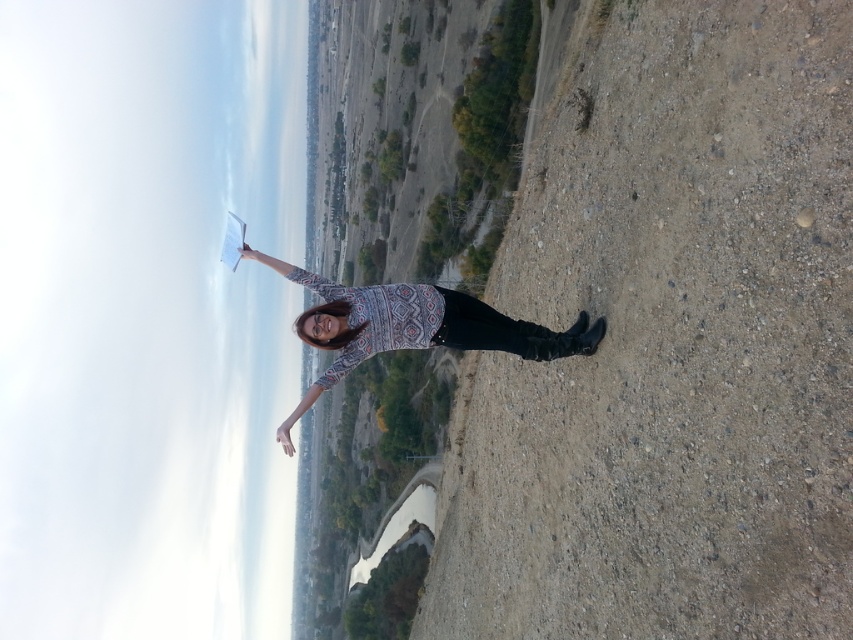
Question: Among these objects, which one is nearest to the camera?

Choices:
 (A) patterned sweater at center
 (B) dirt ground at center

Answer: (B)

Question: Does dirt ground at center have a smaller size compared to patterned sweater at center?

Choices:
 (A) no
 (B) yes

Answer: (A)

Question: Which point is farther from the camera taking this photo?

Choices:
 (A) (814, 472)
 (B) (454, 324)

Answer: (B)

Question: Is dirt ground at center to the left of patterned sweater at center from the viewer's perspective?

Choices:
 (A) yes
 (B) no

Answer: (B)

Question: Is dirt ground at center wider than patterned sweater at center?

Choices:
 (A) yes
 (B) no

Answer: (B)

Question: Among these objects, which one is farthest from the camera?

Choices:
 (A) patterned sweater at center
 (B) dirt ground at center

Answer: (A)